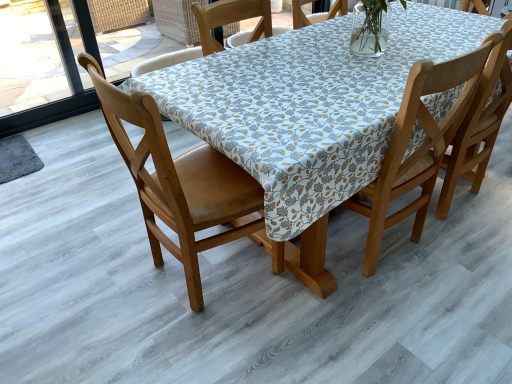
Measure the distance between wooden chair at center, the 2th chair in the left-to-right sequence, and camera.

wooden chair at center, the 2th chair in the left-to-right sequence, and camera are 4.23 feet apart from each other.

Measure the distance between point (436, 73) and camera.

1.31 meters.

This screenshot has height=384, width=512. I want to click on wooden chair at center, which is counted as the first chair, starting from the right, so click(419, 146).

The width and height of the screenshot is (512, 384). What do you see at coordinates (419, 146) in the screenshot?
I see `wooden chair at center, the 2th chair in the left-to-right sequence` at bounding box center [419, 146].

What is the approximate height of wooden chair at left, which is the first chair from left to right?

The height of wooden chair at left, which is the first chair from left to right, is 38.72 inches.

In order to click on wooden chair at left, which is the first chair from left to right in this screenshot , I will do `click(178, 182)`.

This screenshot has height=384, width=512. Describe the element at coordinates (178, 182) in the screenshot. I see `wooden chair at left, which is the first chair from left to right` at that location.

Where is `wooden chair at center, the 2th chair in the left-to-right sequence`? The width and height of the screenshot is (512, 384). wooden chair at center, the 2th chair in the left-to-right sequence is located at coordinates (419, 146).

Considering the positions of objects wooden chair at center, which is counted as the first chair, starting from the right, and wooden chair at left, positioned as the 2th chair in right-to-left order, in the image provided, who is more to the right, wooden chair at center, which is counted as the first chair, starting from the right, or wooden chair at left, positioned as the 2th chair in right-to-left order,?

wooden chair at center, which is counted as the first chair, starting from the right.

Which is behind, wooden chair at center, the 2th chair in the left-to-right sequence, or wooden chair at left, which is the first chair from left to right?

wooden chair at center, the 2th chair in the left-to-right sequence.

Is point (451, 82) positioned behind point (178, 251)?

No, (451, 82) is in front of (178, 251).

From the image's perspective, is wooden chair at center, which is counted as the first chair, starting from the right, located above or below wooden chair at left, positioned as the 2th chair in right-to-left order?

From the image's perspective, wooden chair at center, which is counted as the first chair, starting from the right, appears above wooden chair at left, positioned as the 2th chair in right-to-left order.

From a real-world perspective, is wooden chair at center, which is counted as the first chair, starting from the right, on top of wooden chair at left, which is the first chair from left to right?

Correct, in the physical world, wooden chair at center, which is counted as the first chair, starting from the right, is higher than wooden chair at left, which is the first chair from left to right.

Consider the image. Considering the relative sizes of wooden chair at center, which is counted as the first chair, starting from the right, and wooden chair at left, positioned as the 2th chair in right-to-left order, in the image provided, is wooden chair at center, which is counted as the first chair, starting from the right, wider than wooden chair at left, positioned as the 2th chair in right-to-left order,?

No, wooden chair at center, which is counted as the first chair, starting from the right, is not wider than wooden chair at left, positioned as the 2th chair in right-to-left order.

From their relative heights in the image, would you say wooden chair at center, which is counted as the first chair, starting from the right, is taller or shorter than wooden chair at left, which is the first chair from left to right?

Considering their sizes, wooden chair at center, which is counted as the first chair, starting from the right, has less height than wooden chair at left, which is the first chair from left to right.

In terms of size, does wooden chair at center, which is counted as the first chair, starting from the right, appear bigger or smaller than wooden chair at left, which is the first chair from left to right?

Clearly, wooden chair at center, which is counted as the first chair, starting from the right, is smaller in size than wooden chair at left, which is the first chair from left to right.

Could wooden chair at left, positioned as the 2th chair in right-to-left order, be considered to be inside wooden chair at center, the 2th chair in the left-to-right sequence?

No, wooden chair at center, the 2th chair in the left-to-right sequence, does not contain wooden chair at left, positioned as the 2th chair in right-to-left order.

Can you see wooden chair at center, the 2th chair in the left-to-right sequence, touching wooden chair at left, which is the first chair from left to right?

No, wooden chair at center, the 2th chair in the left-to-right sequence, is not making contact with wooden chair at left, which is the first chair from left to right.

Is wooden chair at center, which is counted as the first chair, starting from the right, facing away from wooden chair at left, positioned as the 2th chair in right-to-left order?

wooden chair at center, which is counted as the first chair, starting from the right, does not have its back to wooden chair at left, positioned as the 2th chair in right-to-left order.

What's the angular difference between wooden chair at center, which is counted as the first chair, starting from the right, and wooden chair at left, positioned as the 2th chair in right-to-left order,'s facing directions?

90 degrees.

How far apart are wooden chair at center, the 2th chair in the left-to-right sequence, and wooden chair at left, positioned as the 2th chair in right-to-left order?

The distance of wooden chair at center, the 2th chair in the left-to-right sequence, from wooden chair at left, positioned as the 2th chair in right-to-left order, is 26.64 inches.

At what (x,y) coordinates should I click in order to perform the action: click on chair that is under the wooden chair at center, the 2th chair in the left-to-right sequence (from a real-world perspective). Please return your answer as a coordinate pair (x, y). Looking at the image, I should click on (178, 182).

Can you confirm if wooden chair at left, which is the first chair from left to right, is positioned to the right of wooden chair at center, which is counted as the first chair, starting from the right?

No, wooden chair at left, which is the first chair from left to right, is not to the right of wooden chair at center, which is counted as the first chair, starting from the right.

Is wooden chair at left, positioned as the 2th chair in right-to-left order, closer to the viewer compared to wooden chair at center, which is counted as the first chair, starting from the right?

Yes, it is.

Is point (164, 171) closer or farther from the camera than point (415, 222)?

Clearly, point (164, 171) is closer to the camera than point (415, 222).

From the image's perspective, which is above, wooden chair at left, positioned as the 2th chair in right-to-left order, or wooden chair at center, which is counted as the first chair, starting from the right?

From the image's view, wooden chair at center, which is counted as the first chair, starting from the right, is above.

From a real-world perspective, which object rests below the other?

In real-world perspective, wooden chair at left, which is the first chair from left to right, is lower.

Looking at their sizes, would you say wooden chair at left, positioned as the 2th chair in right-to-left order, is wider or thinner than wooden chair at center, which is counted as the first chair, starting from the right?

Clearly, wooden chair at left, positioned as the 2th chair in right-to-left order, has more width compared to wooden chair at center, which is counted as the first chair, starting from the right.

Which of these two, wooden chair at left, positioned as the 2th chair in right-to-left order, or wooden chair at center, which is counted as the first chair, starting from the right, stands shorter?

wooden chair at center, which is counted as the first chair, starting from the right.

Does wooden chair at left, which is the first chair from left to right, have a larger size compared to wooden chair at center, which is counted as the first chair, starting from the right?

Yes, wooden chair at left, which is the first chair from left to right, is bigger than wooden chair at center, which is counted as the first chair, starting from the right.

Is wooden chair at center, the 2th chair in the left-to-right sequence, inside wooden chair at left, positioned as the 2th chair in right-to-left order?

Definitely not — wooden chair at center, the 2th chair in the left-to-right sequence, is not inside wooden chair at left, positioned as the 2th chair in right-to-left order.

Would you consider wooden chair at left, which is the first chair from left to right, to be distant from wooden chair at center, the 2th chair in the left-to-right sequence?

No, wooden chair at left, which is the first chair from left to right, is not far away from wooden chair at center, the 2th chair in the left-to-right sequence.

Is wooden chair at left, which is the first chair from left to right, positioned with its back to wooden chair at center, which is counted as the first chair, starting from the right?

No, wooden chair at left, which is the first chair from left to right,'s orientation is not away from wooden chair at center, which is counted as the first chair, starting from the right.

How different are the orientations of wooden chair at left, positioned as the 2th chair in right-to-left order, and wooden chair at center, the 2th chair in the left-to-right sequence, in degrees?

wooden chair at left, positioned as the 2th chair in right-to-left order, and wooden chair at center, the 2th chair in the left-to-right sequence, are facing 90 degrees away from each other.

How distant is wooden chair at left, which is the first chair from left to right, from wooden chair at center, which is counted as the first chair, starting from the right?

The distance of wooden chair at left, which is the first chair from left to right, from wooden chair at center, which is counted as the first chair, starting from the right, is 26.64 inches.

The width and height of the screenshot is (512, 384). Identify the location of chair that appears on the right of wooden chair at left, which is the first chair from left to right. (419, 146).

The image size is (512, 384). Find the location of `chair lying behind the wooden chair at left, which is the first chair from left to right`. chair lying behind the wooden chair at left, which is the first chair from left to right is located at coordinates (419, 146).

I want to click on chair that appears below the wooden chair at center, which is counted as the first chair, starting from the right (from the image's perspective), so click(178, 182).